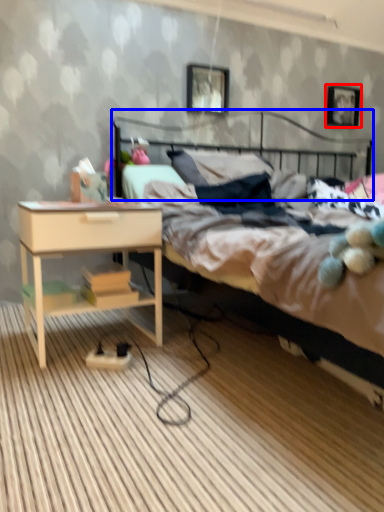
Question: Which object is closer to the camera taking this photo, picture frame (highlighted by a red box) or headboard (highlighted by a blue box)?

Choices:
 (A) picture frame
 (B) headboard

Answer: (B)